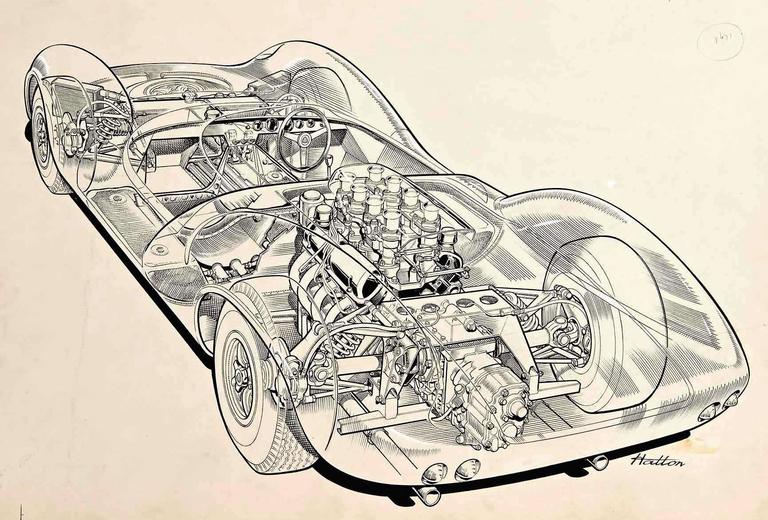
Find the location of a particular element. This screenshot has height=520, width=768. floor board is located at coordinates (183, 204).